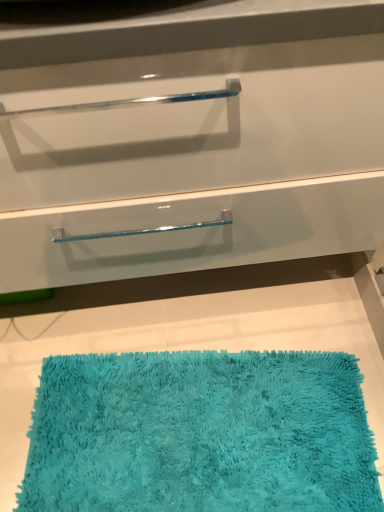
Question: Does turquoise shaggy bath mat at lower center appear on the right side of clear glass drawer at center?

Choices:
 (A) yes
 (B) no

Answer: (A)

Question: Is turquoise shaggy bath mat at lower center further to camera compared to clear glass drawer at center?

Choices:
 (A) no
 (B) yes

Answer: (B)

Question: Considering the relative sizes of turquoise shaggy bath mat at lower center and clear glass drawer at center in the image provided, is turquoise shaggy bath mat at lower center smaller than clear glass drawer at center?

Choices:
 (A) no
 (B) yes

Answer: (B)

Question: From a real-world perspective, is turquoise shaggy bath mat at lower center positioned over clear glass drawer at center based on gravity?

Choices:
 (A) no
 (B) yes

Answer: (A)

Question: From a real-world perspective, is turquoise shaggy bath mat at lower center physically below clear glass drawer at center?

Choices:
 (A) yes
 (B) no

Answer: (A)

Question: From the image's perspective, does turquoise shaggy bath mat at lower center appear lower than clear glass drawer at center?

Choices:
 (A) yes
 (B) no

Answer: (A)

Question: Considering the relative positions of clear glass drawer at center and turquoise shaggy bath mat at lower center in the image provided, is clear glass drawer at center to the right of turquoise shaggy bath mat at lower center from the viewer's perspective?

Choices:
 (A) yes
 (B) no

Answer: (B)

Question: From a real-world perspective, is clear glass drawer at center beneath turquoise shaggy bath mat at lower center?

Choices:
 (A) no
 (B) yes

Answer: (A)

Question: Can you confirm if clear glass drawer at center is bigger than turquoise shaggy bath mat at lower center?

Choices:
 (A) no
 (B) yes

Answer: (B)

Question: Is clear glass drawer at center aimed at turquoise shaggy bath mat at lower center?

Choices:
 (A) no
 (B) yes

Answer: (B)

Question: Can you confirm if clear glass drawer at center is taller than turquoise shaggy bath mat at lower center?

Choices:
 (A) no
 (B) yes

Answer: (B)

Question: Is the position of clear glass drawer at center less distant than that of turquoise shaggy bath mat at lower center?

Choices:
 (A) no
 (B) yes

Answer: (B)

Question: Visually, is turquoise shaggy bath mat at lower center positioned to the left or to the right of clear glass drawer at center?

Choices:
 (A) left
 (B) right

Answer: (B)